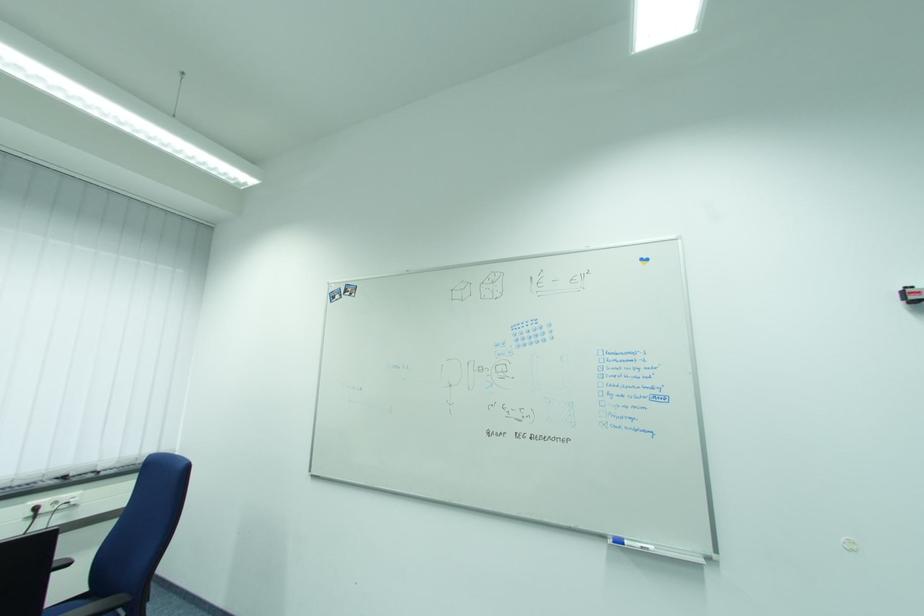
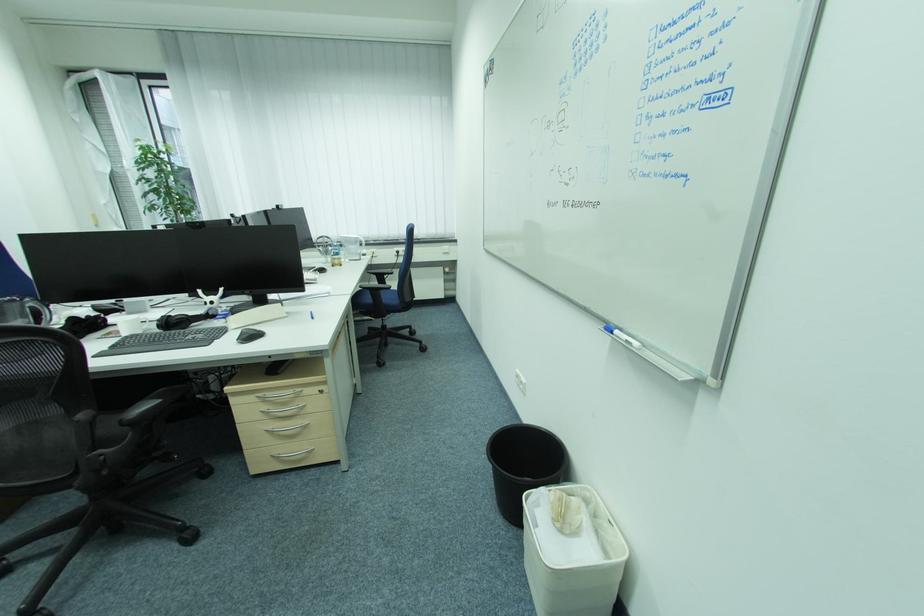
The point at (629, 544) is marked in the first image. Where is the corresponding point in the second image?

(618, 334)